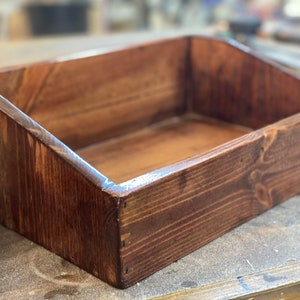
Where is `tabletop`? The width and height of the screenshot is (300, 300). tabletop is located at coordinates (264, 244), (50, 283).